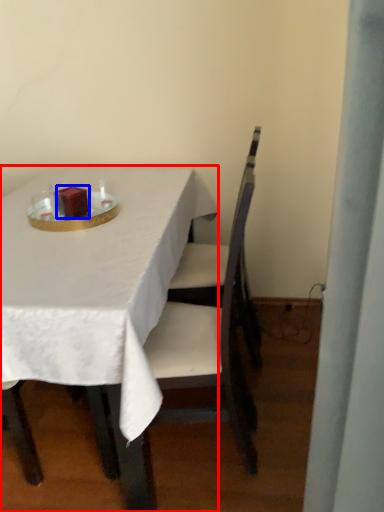
Question: Which of the following is the farthest to the observer, table (highlighted by a red box) or candle (highlighted by a blue box)?

Choices:
 (A) table
 (B) candle

Answer: (B)